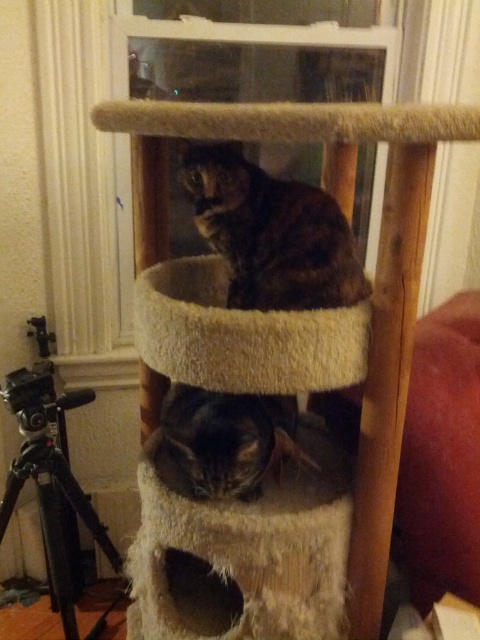
Question: Which point is closer to the camera taking this photo?

Choices:
 (A) (135, 339)
 (B) (303, 244)
 (C) (169, 483)
 (D) (395, 467)

Answer: (D)

Question: Does beige fuzzy cat tree at center have a greater width compared to fuzzy beige cat bed at center?

Choices:
 (A) yes
 (B) no

Answer: (A)

Question: Considering the real-world distances, which object is closest to the dark brown fur at lower center?

Choices:
 (A) beige fuzzy cat tree at center
 (B) fuzzy beige cat bed at center

Answer: (B)

Question: Estimate the real-world distances between objects in this image. Which object is closer to the fuzzy beige cat bed at center?

Choices:
 (A) dark brown fur at lower center
 (B) dark brown fur cat at center
 (C) beige fuzzy cat tree at center

Answer: (B)

Question: Is fuzzy beige cat bed at center thinner than dark brown fur at lower center?

Choices:
 (A) no
 (B) yes

Answer: (A)

Question: Is beige fuzzy cat tree at center below dark brown fur cat at center?

Choices:
 (A) yes
 (B) no

Answer: (A)